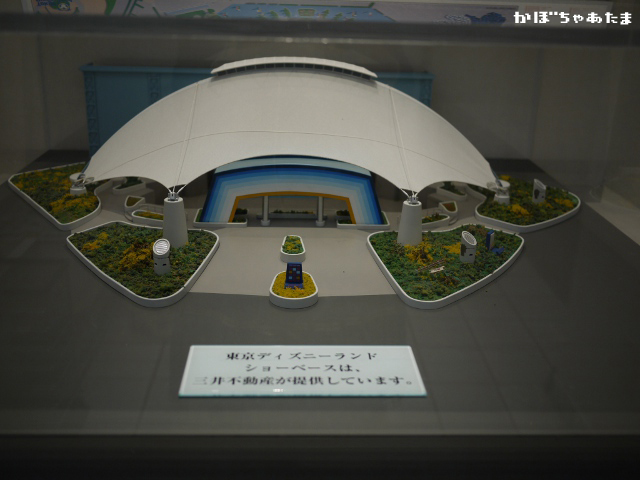
This screenshot has height=480, width=640. Find the location of `blue and white poster`. blue and white poster is located at coordinates (492, 15).